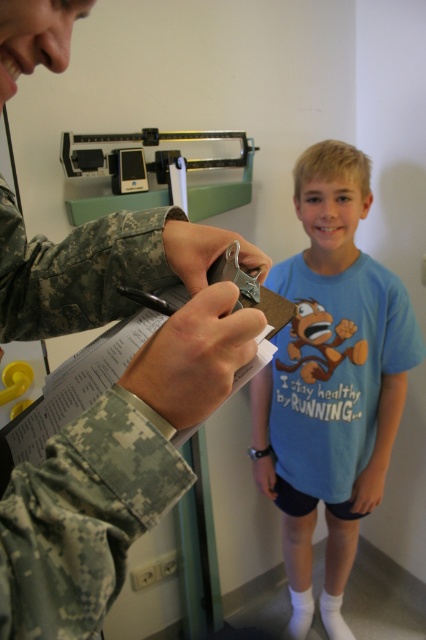
Question: Can you confirm if camouflage uniform at center is positioned above blue cotton shirt at center?

Choices:
 (A) no
 (B) yes

Answer: (B)

Question: Is camouflage uniform at center in front of blue cotton shirt at center?

Choices:
 (A) yes
 (B) no

Answer: (A)

Question: Among these points, which one is farthest from the camera?

Choices:
 (A) (368, 310)
 (B) (40, 564)

Answer: (A)

Question: Which object is farther from the camera taking this photo?

Choices:
 (A) camouflage uniform at center
 (B) blue cotton shirt at center

Answer: (B)

Question: Is camouflage uniform at center bigger than blue cotton shirt at center?

Choices:
 (A) yes
 (B) no

Answer: (B)